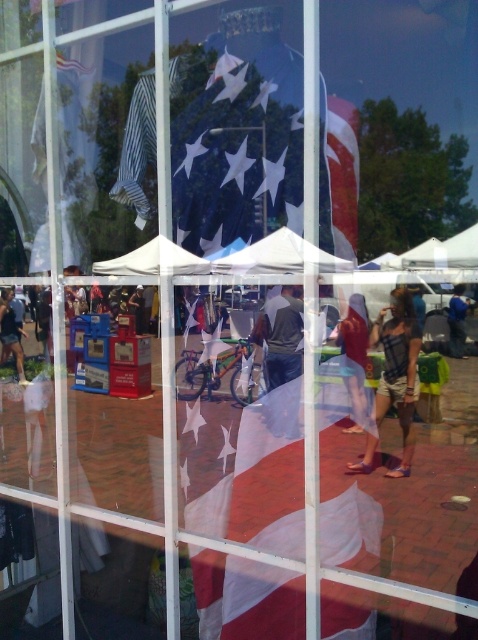
You are organizing a backpacking trip and need to pack your gear. You have a dark gray backpack at center and a light brown leather jacket at center. Which item should you choose if you need more storage space?

The dark gray backpack at center is larger in size than the light brown leather jacket at center, so you should choose the dark gray backpack at center for more storage space.

You are standing inside the building looking out through the window. There is a point marked at coordinates (343, 173). What object is located at that point?

The red fabric flag at center is located at point (343, 173).